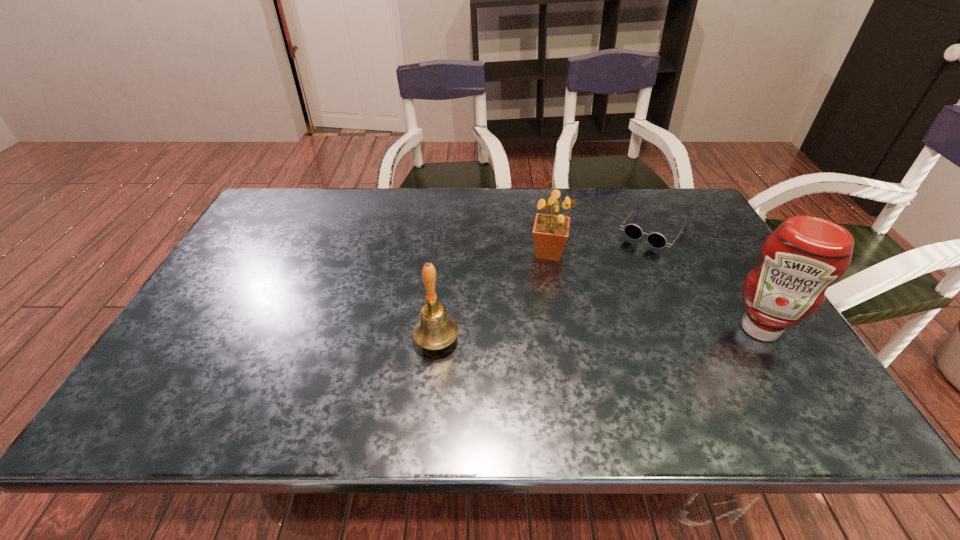
Where is `vacant space on the desktop that is between the leftmost object and the tallest object and is positioned at the front of the sunflower with flowers visible`? This screenshot has width=960, height=540. vacant space on the desktop that is between the leftmost object and the tallest object and is positioned at the front of the sunflower with flowers visible is located at coordinates (648, 333).

At what (x,y) coordinates should I click in order to perform the action: click on vacant spot on the desktop that is between the leftmost object and the tallest object and is positioned on the front-facing side of the shortest object. Please return your answer as a coordinate pair (x, y). This screenshot has width=960, height=540. Looking at the image, I should click on (571, 335).